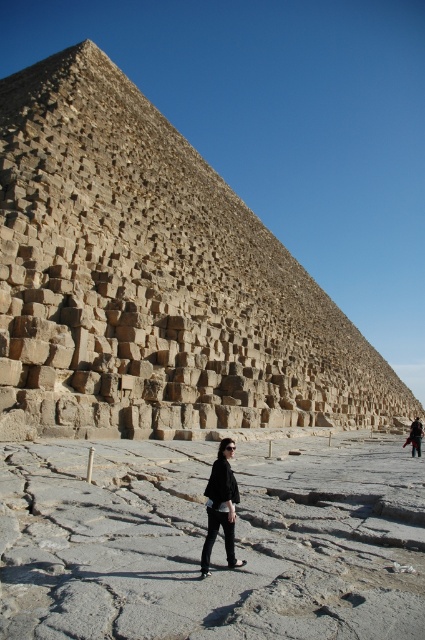
Question: Does black matte jacket at center lie behind dark brown leather jacket at lower right?

Choices:
 (A) no
 (B) yes

Answer: (A)

Question: Based on their relative distances, which object is nearer to the dark brown leather jacket at lower right?

Choices:
 (A) black matte jacket at center
 (B) brown stone pyramid at center

Answer: (A)

Question: Which object appears farthest from the camera in this image?

Choices:
 (A) dark brown leather jacket at lower right
 (B) brown stone pyramid at center

Answer: (A)

Question: Is brown stone pyramid at center smaller than black matte jacket at center?

Choices:
 (A) no
 (B) yes

Answer: (A)

Question: Is brown stone pyramid at center wider than dark brown leather jacket at lower right?

Choices:
 (A) yes
 (B) no

Answer: (A)

Question: Which object appears closest to the camera in this image?

Choices:
 (A) brown stone pyramid at center
 (B) dark brown leather jacket at lower right
 (C) black matte jacket at center

Answer: (C)